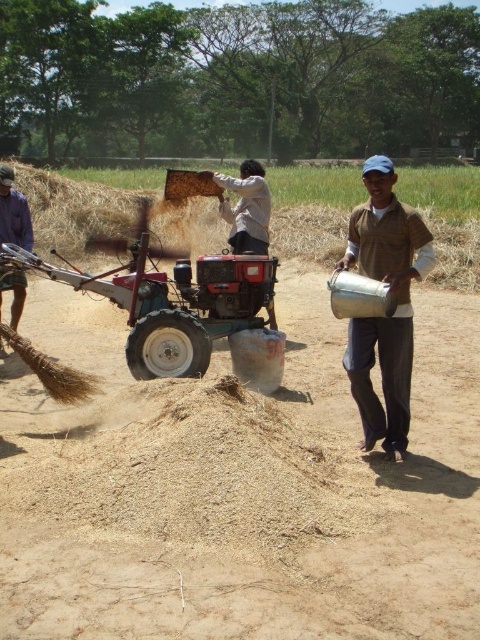
You are standing at the point marked by the coordinates point (240,493) in the image. What is the object located at this point?

The object located at point (240,493) is the brown dirt track at center.

You are navigating through the field and want to reach the point at the end of the path. You are currently at point (210, 605). There is another point at (348, 333). Which direction should you move to get closer to your destination?

Since point (210, 605) is in front of point (348, 333), you should move away from point (348, 333) to reach the end of the path.

You are standing at the point with coordinates [240,493] in the image. What is the object located at that point?

The point at coordinates [240,493] corresponds to the brown dirt track at center.